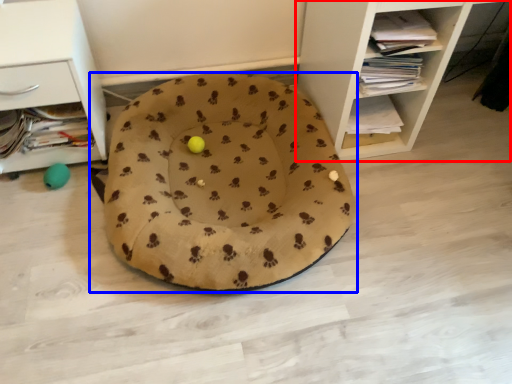
Question: Which of the following is the farthest to the observer, shelf (highlighted by a red box) or dog bed (highlighted by a blue box)?

Choices:
 (A) shelf
 (B) dog bed

Answer: (B)